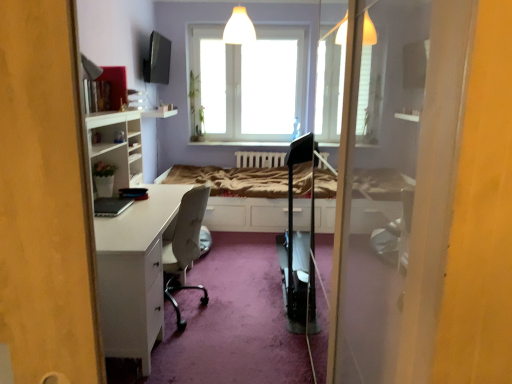
Question: Is white glossy desk at left aimed at white wooden bed frame at center?

Choices:
 (A) yes
 (B) no

Answer: (B)

Question: Is white glossy desk at left shorter than white wooden bed frame at center?

Choices:
 (A) no
 (B) yes

Answer: (A)

Question: Is white glossy desk at left looking in the opposite direction of white wooden bed frame at center?

Choices:
 (A) no
 (B) yes

Answer: (A)

Question: Is white glossy desk at left thinner than white wooden bed frame at center?

Choices:
 (A) yes
 (B) no

Answer: (A)

Question: From the image's perspective, is white glossy desk at left located above white wooden bed frame at center?

Choices:
 (A) yes
 (B) no

Answer: (B)

Question: Considering the relative positions of white glossy desk at left and white wooden bed frame at center in the image provided, is white glossy desk at left behind white wooden bed frame at center?

Choices:
 (A) no
 (B) yes

Answer: (A)

Question: Is white wooden bed frame at center positioned beyond the bounds of white glossy desk at left?

Choices:
 (A) yes
 (B) no

Answer: (A)

Question: Could white glossy desk at left be considered to be inside white wooden bed frame at center?

Choices:
 (A) yes
 (B) no

Answer: (B)

Question: Is white wooden bed frame at center not close to white glossy desk at left?

Choices:
 (A) no
 (B) yes

Answer: (B)

Question: Can you confirm if white wooden bed frame at center is thinner than white glossy desk at left?

Choices:
 (A) yes
 (B) no

Answer: (B)

Question: Is white wooden bed frame at center placed right next to white glossy desk at left?

Choices:
 (A) yes
 (B) no

Answer: (B)

Question: Is white wooden bed frame at center further to camera compared to white glossy desk at left?

Choices:
 (A) no
 (B) yes

Answer: (B)

Question: Considering the relative positions of white wooden bed frame at center and transparent glass window at center in the image provided, is white wooden bed frame at center to the left of transparent glass window at center from the viewer's perspective?

Choices:
 (A) no
 (B) yes

Answer: (B)